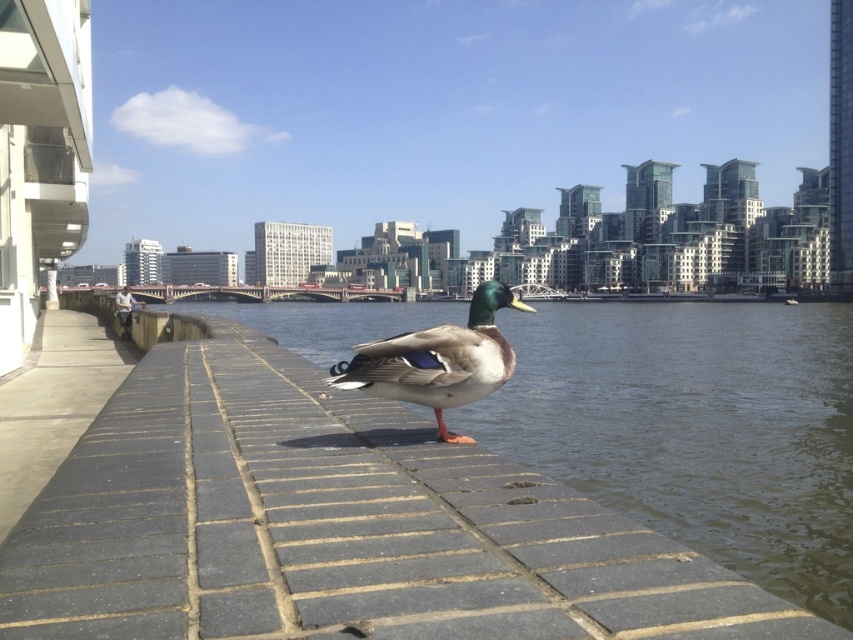
You are a photographer standing on the walkway. You want to capture a photo of the clear water at center and the green glossy duck at center. Which object should you focus on first if you want to include both in the frame without moving the camera?

The clear water at center should be focused on first because its width is larger than the green glossy duck at center, allowing it to occupy more space in the frame while still including the duck.

In the scene shown: You are a delivery robot that needs to reach the charging station located at the lower left corner of the image. You are currently facing the green glossy duck at center. The gray concrete pavement at lower left is an obstacle. Can you navigate around it to reach your destination?

The gray concrete pavement at lower left is positioned under green glossy duck at center, so the robot can navigate around it by moving to the right side of the duck to avoid the pavement and reach the charging station.

You are standing at the camera position and want to reach point (790, 396). Is the distance more than 200 feet?

The distance between point (790, 396) and the camera is 222.57 feet, so yes, the distance is more than 200 feet.